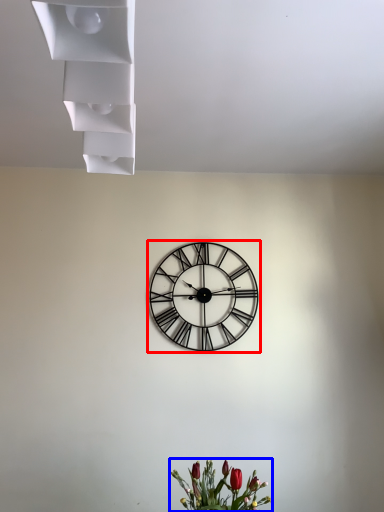
Question: Which of the following is the farthest to the observer, wall clock (highlighted by a red box) or floral arrangement (highlighted by a blue box)?

Choices:
 (A) wall clock
 (B) floral arrangement

Answer: (A)